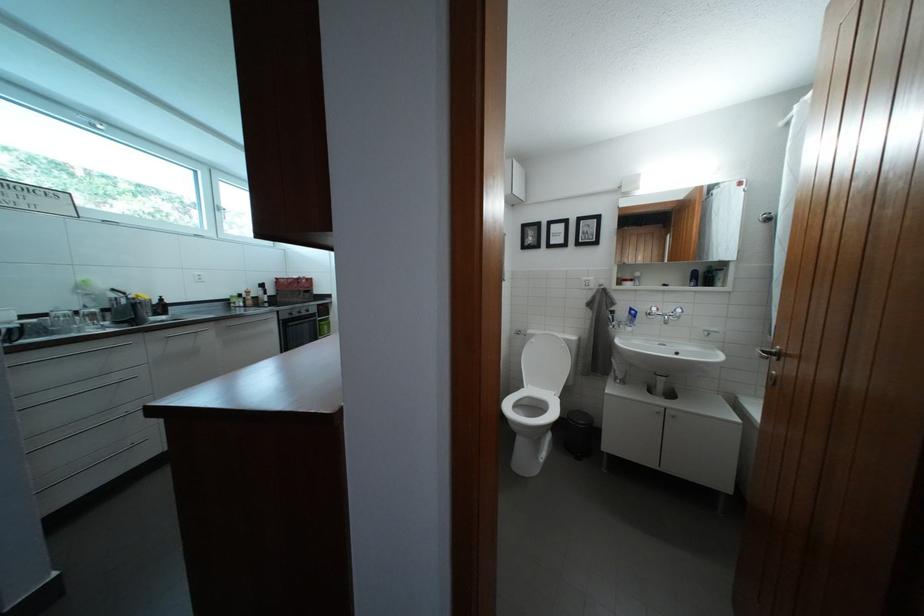
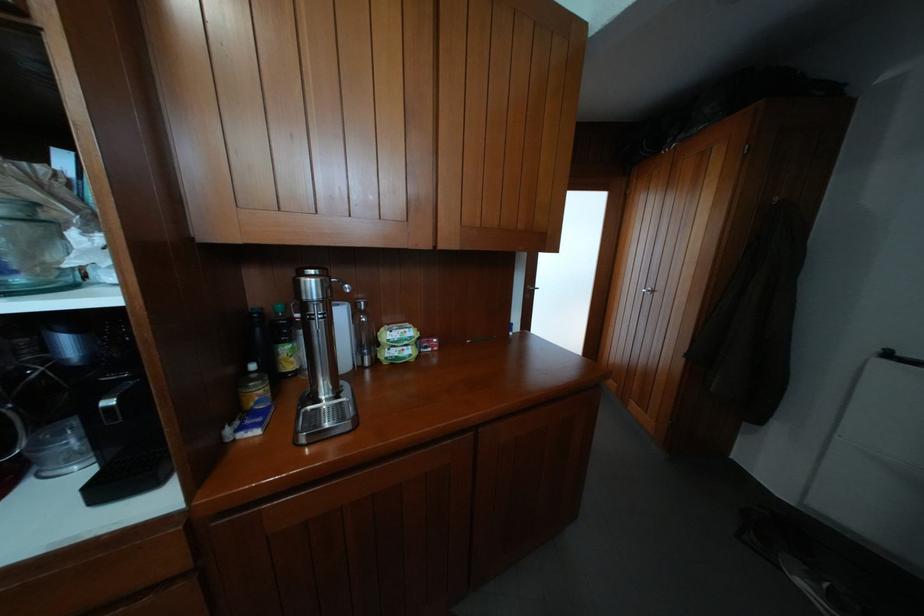
Question: I am providing you with two images of the same scene from different viewpoints. Which of the following objects are not visible in image2?

Choices:
 (A) black trash can
 (B) clear glass bottle
 (C) box of gloves
 (D) small green carton

Answer: (A)